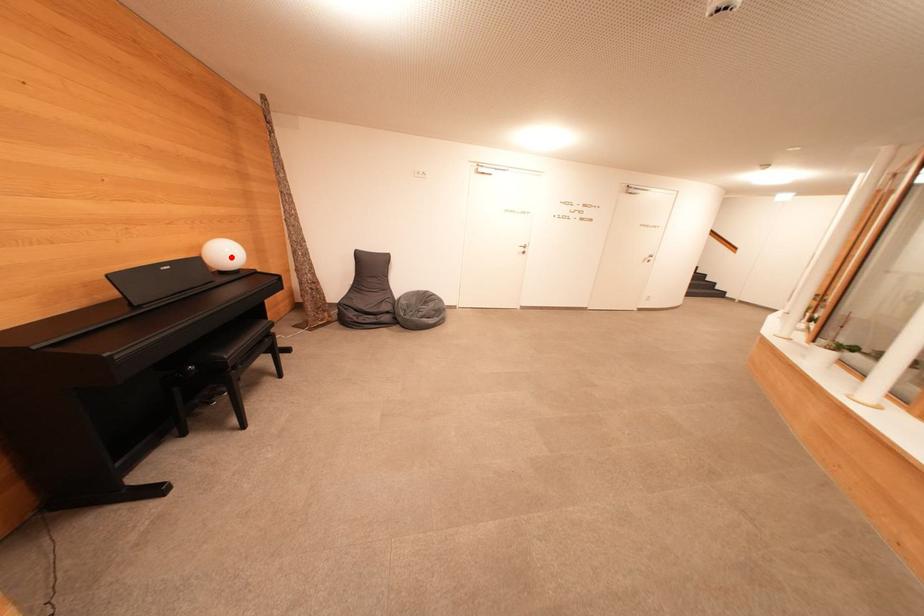
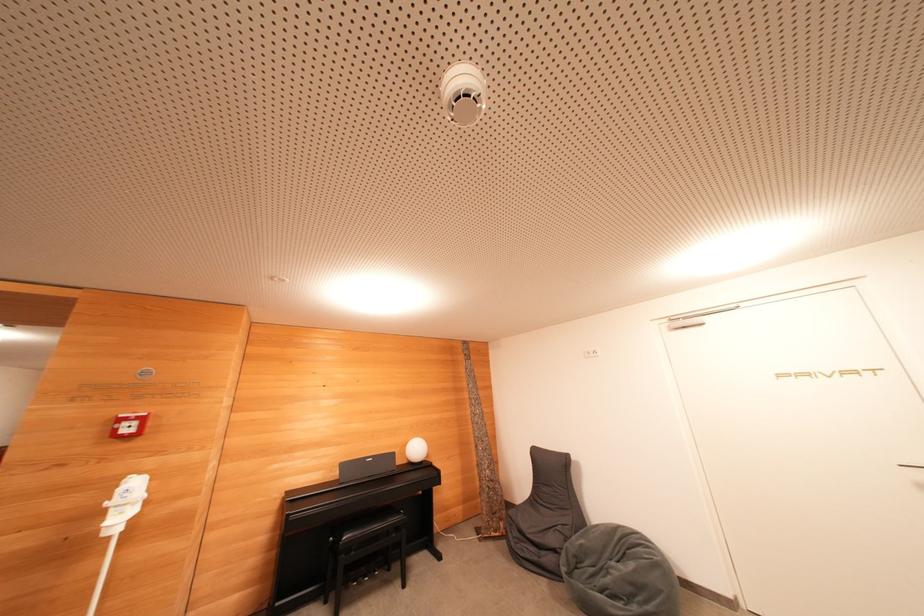
In the second image, find the point that corresponds to the highlighted location in the first image.

(419, 453)